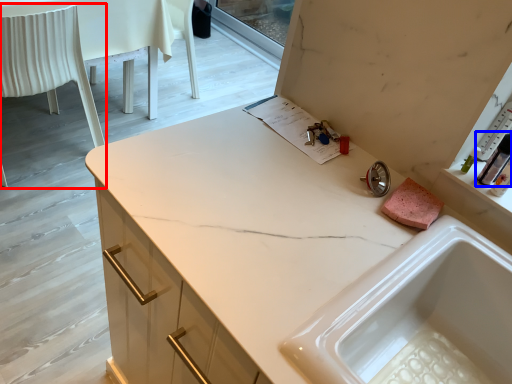
Question: Which point is further to the camera, chair (highlighted by a red box) or toiletry (highlighted by a blue box)?

Choices:
 (A) chair
 (B) toiletry

Answer: (A)